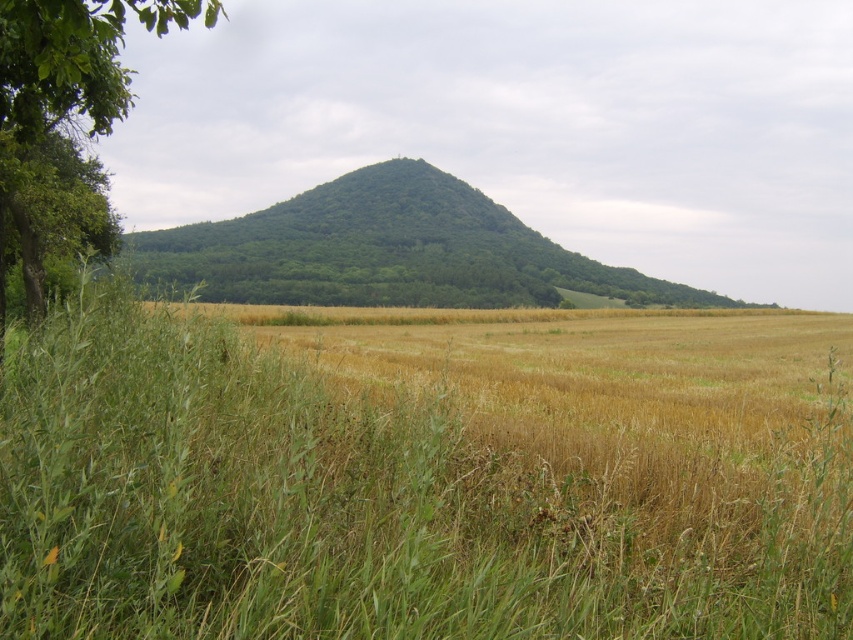
You are a farmer standing in the middle of the brown grassy field at center and want to check the health of the green leafy tree at left. Which direction should you walk to get closer to the tree?

The green leafy tree at left is located to the left side of the brown grassy field at center. Since the brown grassy field at center has a lesser height compared to the green leafy tree at left, you should walk towards the left direction to approach the tree.

You are standing at the origin point in the image and want to reach the brown grassy field at center. Which direction should you move in to reach it?

Since the brown grassy field at center is located at the coordinates point (424, 474), you should move towards the right and slightly forward to reach it.

You are a farmer standing at the edge of the brown grassy field at center and the green leafy tree at left. You want to walk to the tree to check its health. Which direction should you move relative to the field?

The green leafy tree at left is positioned to the left of the brown grassy field at center, so you should move to the left relative to the field to reach the tree.